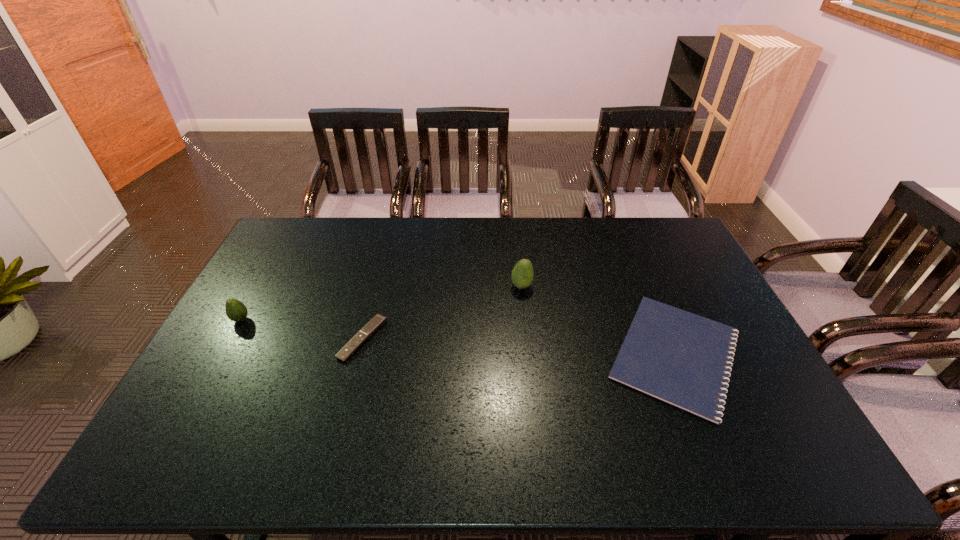
Where is `the tallest object`? the tallest object is located at coordinates (522, 276).

Identify the location of the farther avocado. The width and height of the screenshot is (960, 540). (522, 276).

The height and width of the screenshot is (540, 960). I want to click on the left avocado, so click(x=236, y=311).

This screenshot has width=960, height=540. In order to click on the shorter avocado in this screenshot , I will do coord(236,311).

Locate an element on the screen. remote control is located at coordinates (378, 320).

I want to click on the second object from left to right, so click(x=378, y=320).

Locate an element on the screen. This screenshot has height=540, width=960. the shortest object is located at coordinates (683, 359).

Where is `the rightmost object`? the rightmost object is located at coordinates (683, 359).

Where is `free point located on the front of the tallest object`? Image resolution: width=960 pixels, height=540 pixels. free point located on the front of the tallest object is located at coordinates (530, 366).

This screenshot has height=540, width=960. Identify the location of vacant space located 0.230m on the back of the shorter avocado. (271, 266).